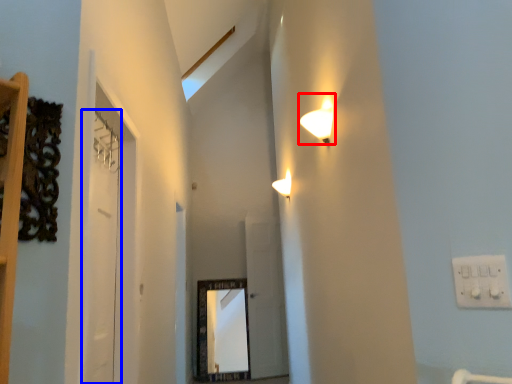
Question: Which point is further to the camera, lamp (highlighted by a red box) or door (highlighted by a blue box)?

Choices:
 (A) lamp
 (B) door

Answer: (A)